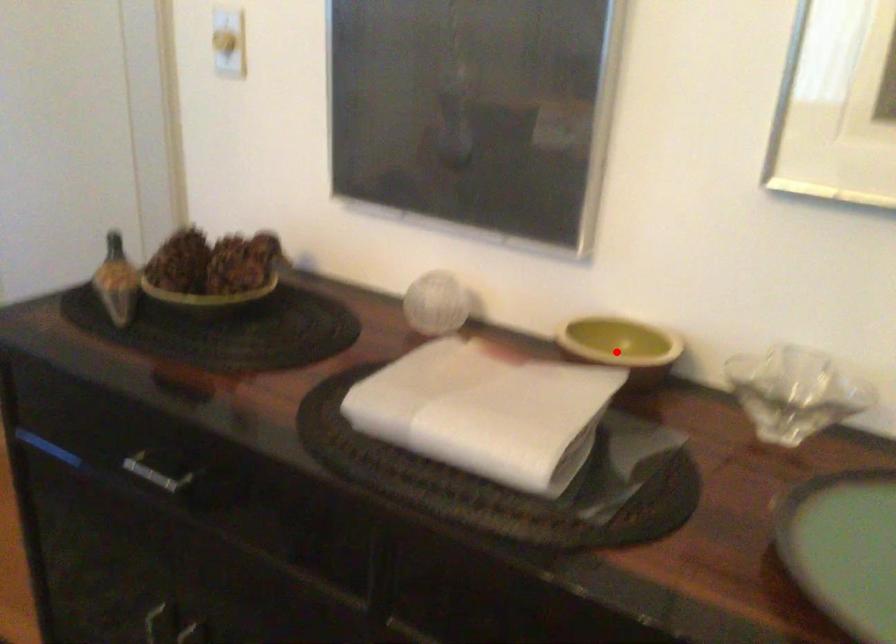
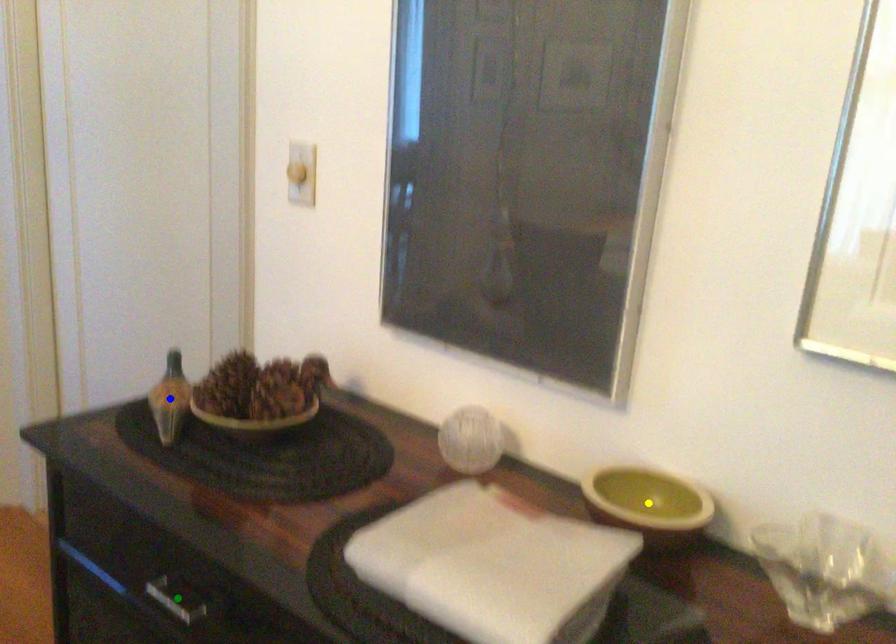
Question: I am providing you with two images of the same scene from different viewpoints. A red point is marked on the first image. You are given multiple points on the second image. Which point in image 2 represents the same 3d spot as the red point in image 1?

Choices:
 (A) blue point
 (B) yellow point
 (C) green point

Answer: (B)